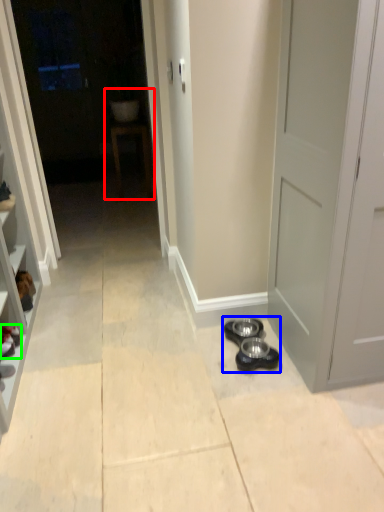
Question: Considering the real-world distances, which object is closest to sink (highlighted by a red box)? shoe (highlighted by a blue box) or footwear (highlighted by a green box).

Choices:
 (A) shoe
 (B) footwear

Answer: (B)